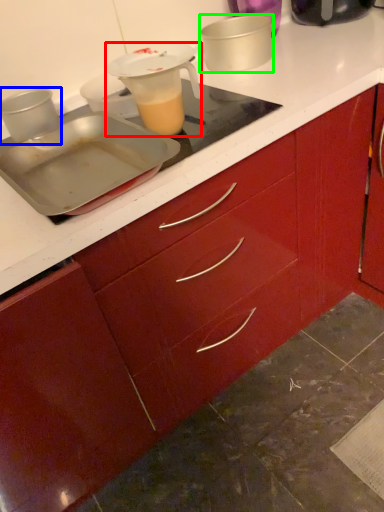
Question: Considering the real-world distances, which object is farthest from jug (highlighted by a red box)? kitchen appliance (highlighted by a blue box) or kitchen appliance (highlighted by a green box)?

Choices:
 (A) kitchen appliance
 (B) kitchen appliance

Answer: (B)